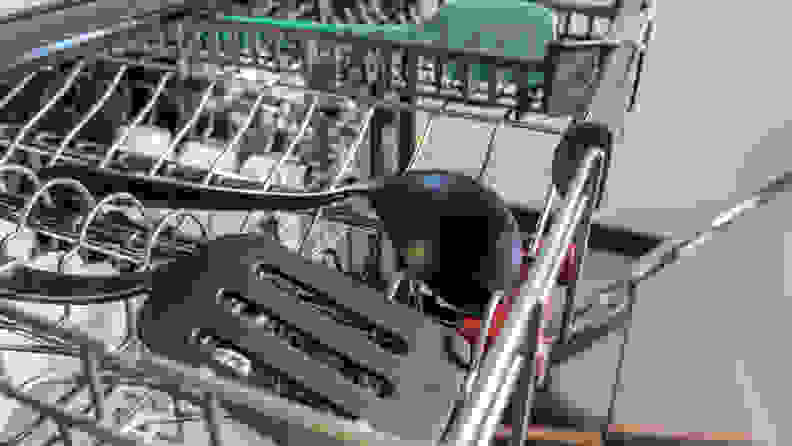
I want to click on black spatula handle, so click(96, 285).